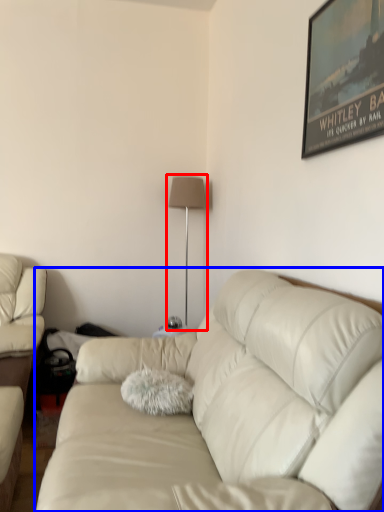
Question: Which object is further to the camera taking this photo, table lamp (highlighted by a red box) or studio couch (highlighted by a blue box)?

Choices:
 (A) table lamp
 (B) studio couch

Answer: (A)